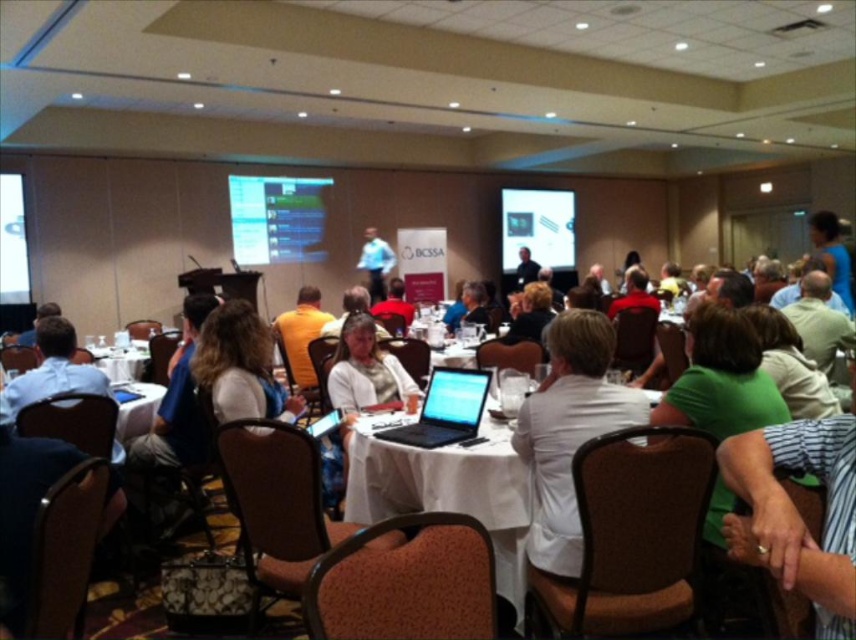
You are organizing an event and need to know which screen is wider. You see the matte black screen at center and the matte black projector screen at center. Which one is wider?

The matte black projector screen at center is wider than the matte black screen at center.